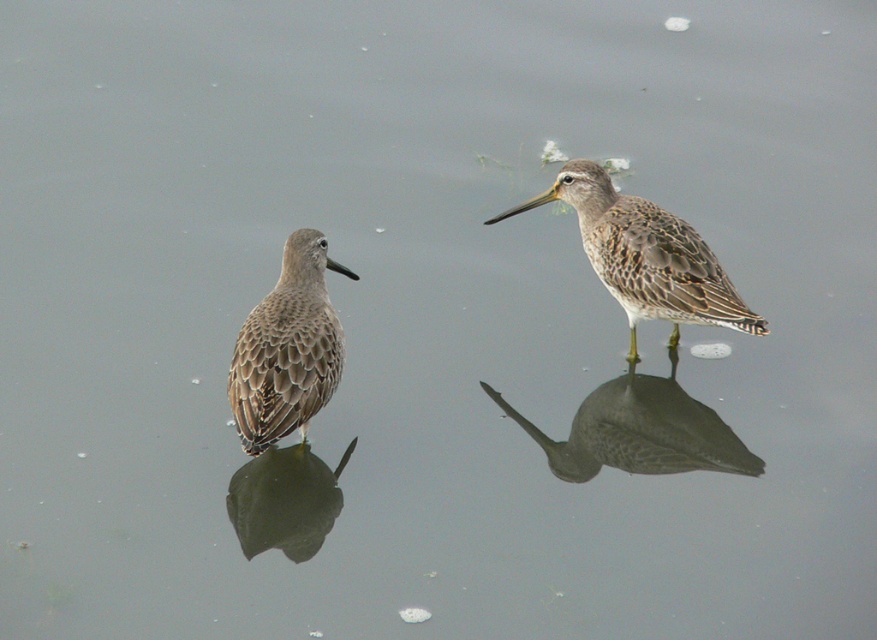
You are a birdwatcher trying to identify the exact position of the brown speckled sandpiper at right in the image. According to the coordinates provided, where is it positioned?

The brown speckled sandpiper at right is located at point [645,256].

You are a birdwatcher trying to identify the birds in the image. You notice two brown speckled birds at right. Which one is closer to you, the brown speckled sandpiper at right or the brown speckled bird at right?

The brown speckled sandpiper at right is closer to you because it is in front of the brown speckled bird at right.